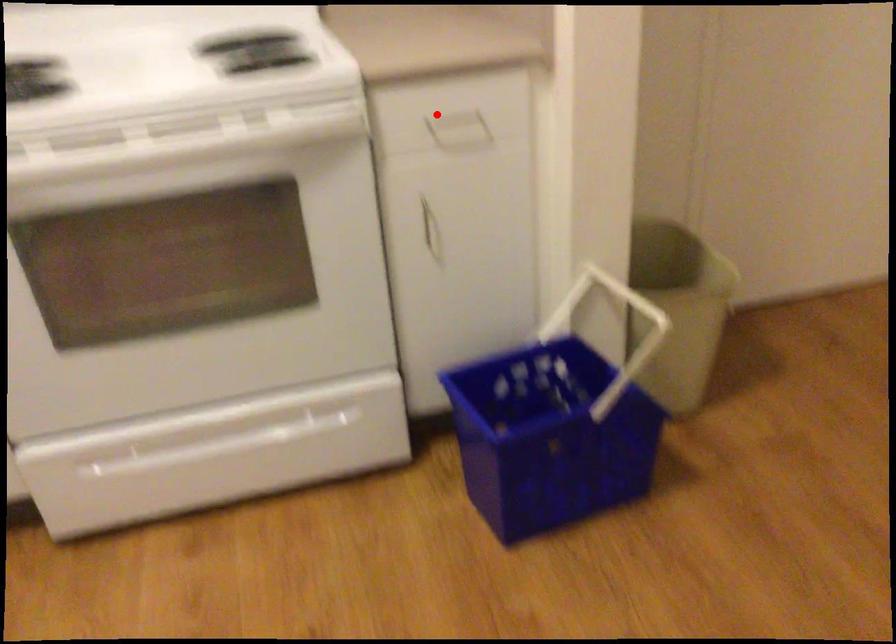
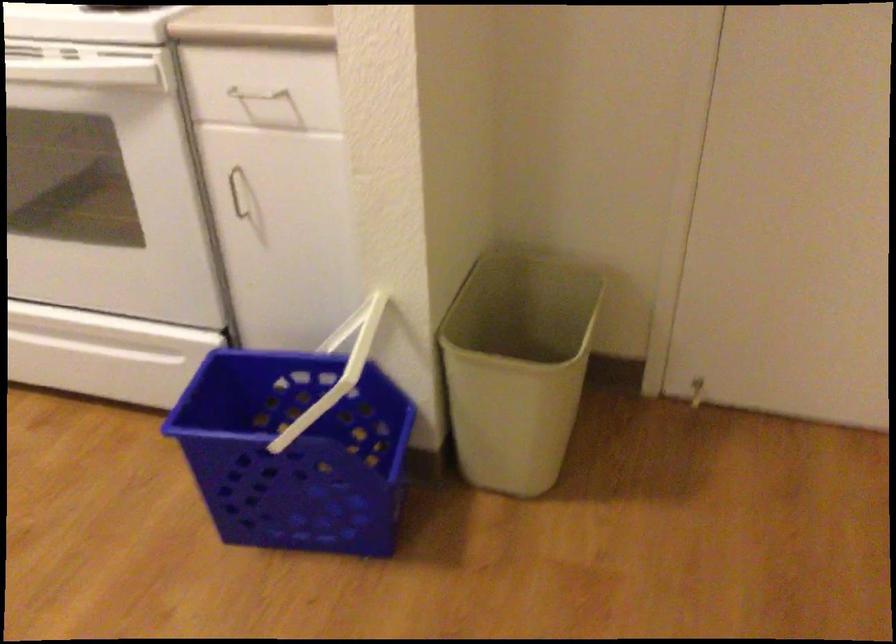
The point at the highlighted location is marked in the first image. Where is the corresponding point in the second image?

(253, 98)